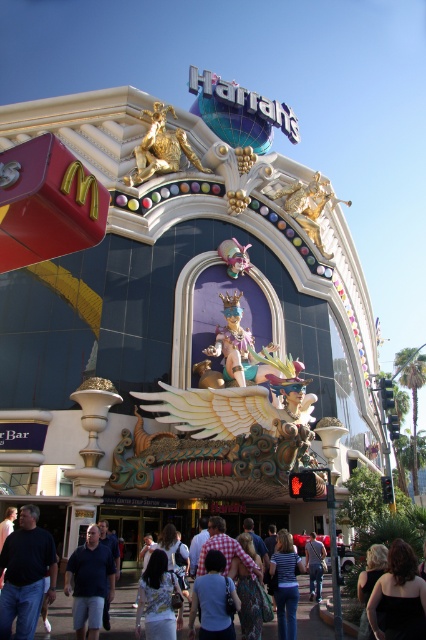
Which is more to the left, white matte shirt at center or denim jacket at lower center?

Positioned to the left is white matte shirt at center.

Does white matte shirt at center have a lesser width compared to denim jacket at lower center?

No, white matte shirt at center is not thinner than denim jacket at lower center.

The image size is (426, 640). In order to click on white matte shirt at center in this screenshot , I will do `click(158, 600)`.

Can you confirm if dark blue shirt at lower left is positioned to the left of blue cotton shirt at center?

Correct, you'll find dark blue shirt at lower left to the left of blue cotton shirt at center.

Is dark blue shirt at lower left further to camera compared to blue cotton shirt at center?

No.

Identify the location of dark blue shirt at lower left. This screenshot has width=426, height=640. (25, 573).

Between dark blue shirt at center and checkered fabric dress at center, which one has more height?

dark blue shirt at center

Is dark blue shirt at center positioned in front of checkered fabric dress at center?

Yes, dark blue shirt at center is closer to the viewer.

Find the location of a particular element. The image size is (426, 640). dark blue shirt at center is located at coordinates (89, 582).